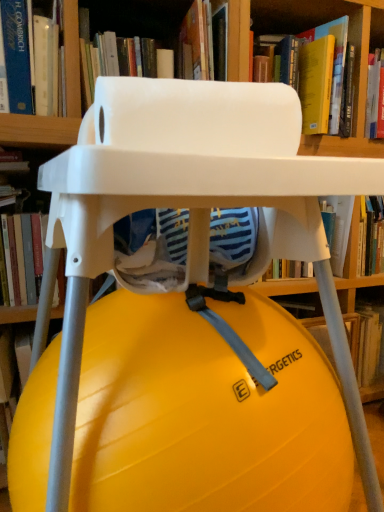
Question: From a real-world perspective, is yellow rubber ball at center below blue hardcover book at upper left, marked as the 4th book in a right-to-left arrangement?

Choices:
 (A) yes
 (B) no

Answer: (A)

Question: From the image's perspective, is yellow rubber ball at center over blue hardcover book at upper left, which is counted as the second book, starting from the left?

Choices:
 (A) yes
 (B) no

Answer: (B)

Question: Would you say yellow rubber ball at center contains blue hardcover book at upper left, which is counted as the second book, starting from the left?

Choices:
 (A) no
 (B) yes

Answer: (A)

Question: Considering the relative positions of yellow rubber ball at center and blue hardcover book at upper left, marked as the 4th book in a right-to-left arrangement, in the image provided, is yellow rubber ball at center to the left of blue hardcover book at upper left, marked as the 4th book in a right-to-left arrangement, from the viewer's perspective?

Choices:
 (A) no
 (B) yes

Answer: (A)

Question: Can you confirm if yellow rubber ball at center is bigger than blue hardcover book at upper left, marked as the 4th book in a right-to-left arrangement?

Choices:
 (A) no
 (B) yes

Answer: (B)

Question: Is yellow matte exercise ball at center, the fifth book viewed from the left, wider or thinner than yellow rubber ball at center?

Choices:
 (A) wide
 (B) thin

Answer: (B)

Question: Relative to yellow rubber ball at center, is yellow matte exercise ball at center, the fifth book viewed from the left, in front or behind?

Choices:
 (A) behind
 (B) front

Answer: (A)

Question: In terms of size, does yellow matte exercise ball at center, the fifth book viewed from the left, appear bigger or smaller than yellow rubber ball at center?

Choices:
 (A) small
 (B) big

Answer: (A)

Question: From the image's perspective, is yellow matte exercise ball at center, acting as the first book starting from the right, positioned above or below yellow rubber ball at center?

Choices:
 (A) below
 (B) above

Answer: (A)

Question: From the image's perspective, is yellow hardcover book at upper center, arranged as the fourth book when viewed from the left, positioned above or below blue hardcover book at upper left, which is counted as the second book, starting from the left?

Choices:
 (A) above
 (B) below

Answer: (A)

Question: In terms of height, does yellow hardcover book at upper center, arranged as the 2th book when viewed from the right, look taller or shorter compared to blue hardcover book at upper left, marked as the 4th book in a right-to-left arrangement?

Choices:
 (A) short
 (B) tall

Answer: (A)

Question: Is yellow hardcover book at upper center, arranged as the fourth book when viewed from the left, wider or thinner than blue hardcover book at upper left, which is counted as the second book, starting from the left?

Choices:
 (A) thin
 (B) wide

Answer: (B)

Question: Is yellow hardcover book at upper center, arranged as the fourth book when viewed from the left, bigger or smaller than blue hardcover book at upper left, which is counted as the second book, starting from the left?

Choices:
 (A) small
 (B) big

Answer: (B)

Question: Is yellow matte exercise ball at center, the fifth book viewed from the left, spatially inside hardcover book at left, which appears as the 5th book when viewed from the right, or outside of it?

Choices:
 (A) outside
 (B) inside

Answer: (A)

Question: From the image's perspective, relative to hardcover book at left, which is the first book in left-to-right order, is yellow matte exercise ball at center, acting as the first book starting from the right, above or below?

Choices:
 (A) below
 (B) above

Answer: (A)